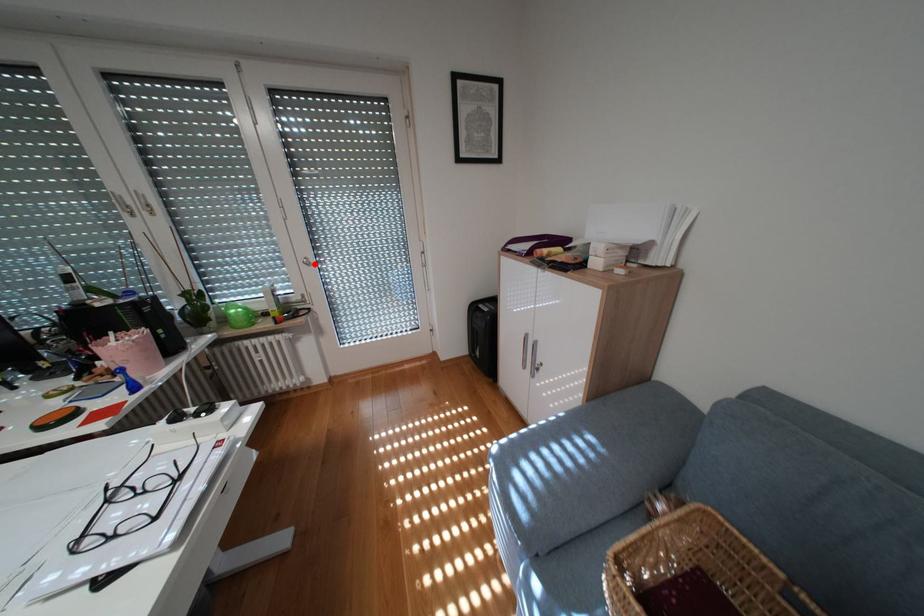
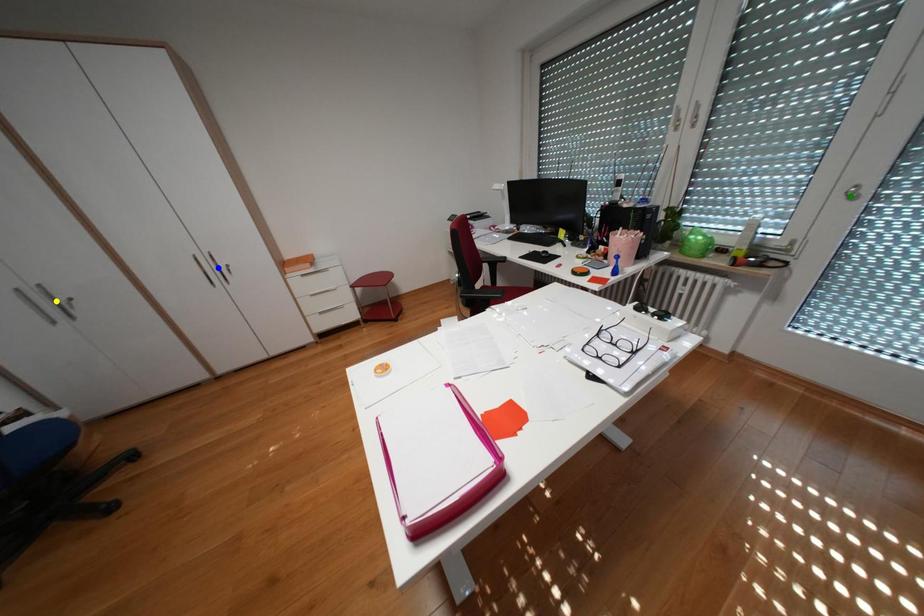
Question: I am providing you with two images of the same scene from different viewpoints. A red point is marked on the first image. You are given multiple points on the second image. Which point in image 2 represents the same 3d spot as the red point in image 1?

Choices:
 (A) blue point
 (B) yellow point
 (C) green point

Answer: (C)